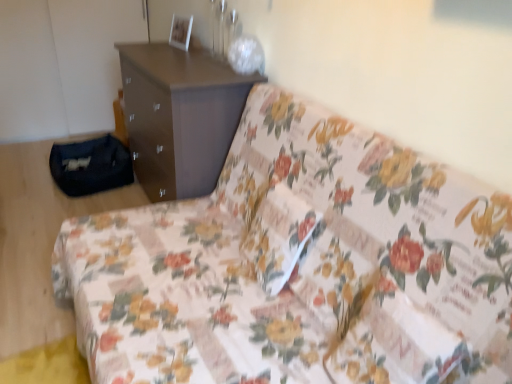
Question: Is brown matte chest of drawers at upper center behind floral fabric pillow at center?

Choices:
 (A) yes
 (B) no

Answer: (A)

Question: From the image's perspective, is brown matte chest of drawers at upper center above floral fabric pillow at center?

Choices:
 (A) yes
 (B) no

Answer: (A)

Question: Can you confirm if brown matte chest of drawers at upper center is smaller than floral fabric pillow at center?

Choices:
 (A) yes
 (B) no

Answer: (B)

Question: Is brown matte chest of drawers at upper center thinner than floral fabric pillow at center?

Choices:
 (A) yes
 (B) no

Answer: (B)

Question: Can you confirm if brown matte chest of drawers at upper center is wider than floral fabric pillow at center?

Choices:
 (A) yes
 (B) no

Answer: (A)

Question: Is brown matte chest of drawers at upper center directly adjacent to floral fabric pillow at center?

Choices:
 (A) no
 (B) yes

Answer: (A)

Question: Is brown matte chest of drawers at upper center completely or partially inside floral fabric couch at center?

Choices:
 (A) no
 (B) yes

Answer: (A)

Question: Considering the relative sizes of floral fabric couch at center and brown matte chest of drawers at upper center in the image provided, is floral fabric couch at center wider than brown matte chest of drawers at upper center?

Choices:
 (A) no
 (B) yes

Answer: (B)

Question: Is floral fabric couch at center at the left side of brown matte chest of drawers at upper center?

Choices:
 (A) yes
 (B) no

Answer: (B)

Question: From the image's perspective, would you say floral fabric couch at center is shown under brown matte chest of drawers at upper center?

Choices:
 (A) yes
 (B) no

Answer: (A)

Question: Are floral fabric couch at center and brown matte chest of drawers at upper center beside each other?

Choices:
 (A) yes
 (B) no

Answer: (B)

Question: Considering the relative sizes of floral fabric couch at center and brown matte chest of drawers at upper center in the image provided, is floral fabric couch at center smaller than brown matte chest of drawers at upper center?

Choices:
 (A) yes
 (B) no

Answer: (B)

Question: Considering the relative sizes of brown matte chest of drawers at upper center and floral fabric couch at center in the image provided, is brown matte chest of drawers at upper center taller than floral fabric couch at center?

Choices:
 (A) yes
 (B) no

Answer: (A)